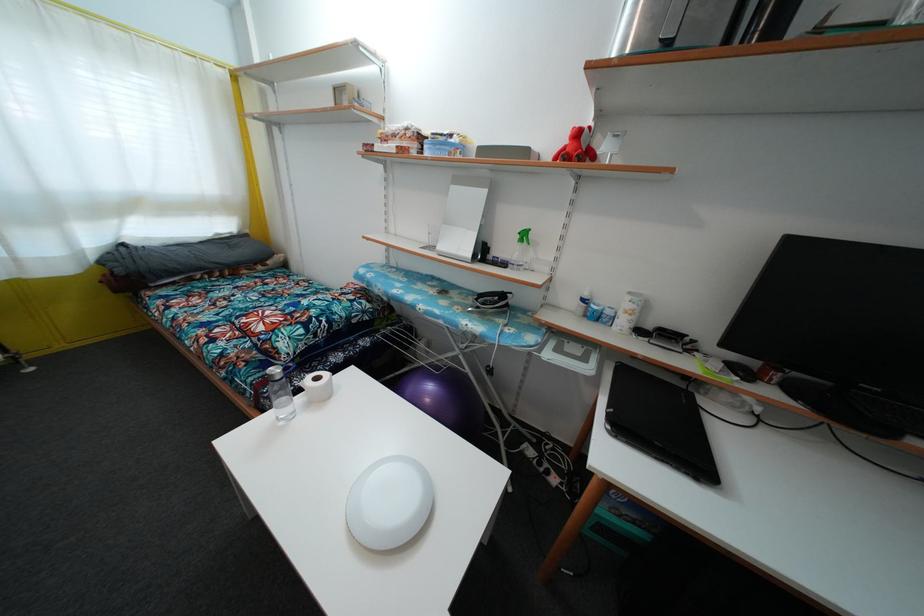
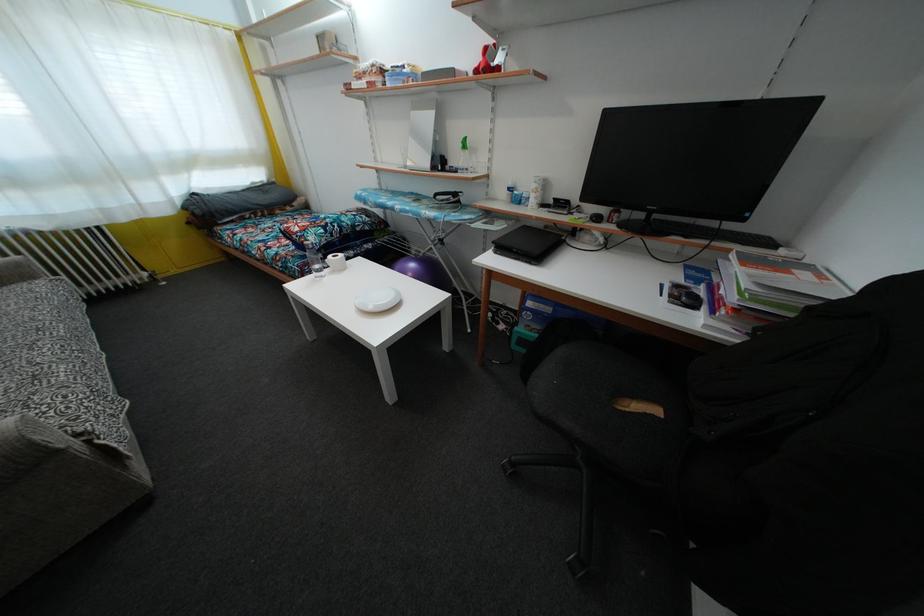
Find the pixel in the second image that matches (269,347) in the first image.

(305, 244)